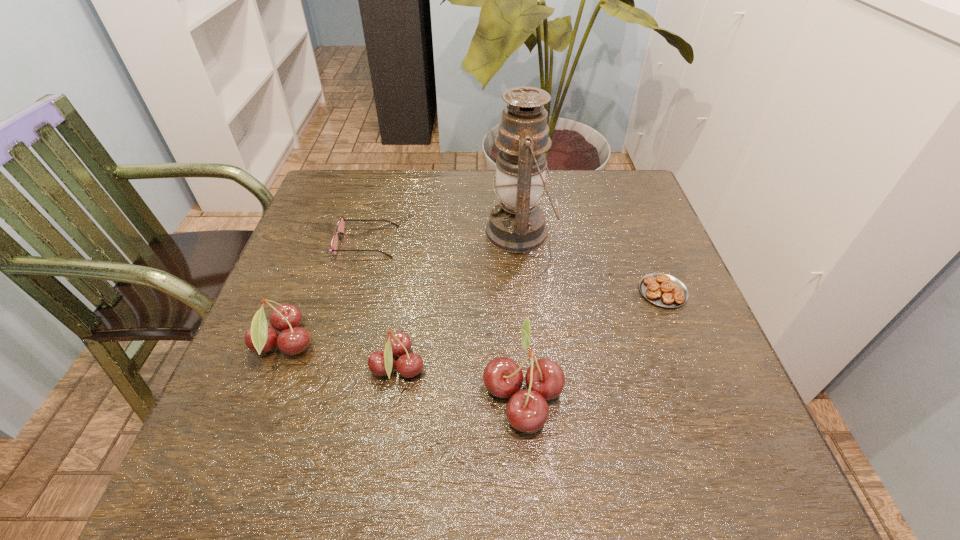
Select which object appears as the fourth closest to the fourth tallest object. Please provide its 2D coordinates. Your answer should be formatted as a tuple, i.e. [(x, y)], where the tuple contains the x and y coordinates of a point satisfying the conditions above.

[(517, 225)]

Select which cherry is the third closest to the second shortest object. Please provide its 2D coordinates. Your answer should be formatted as a tuple, i.e. [(x, y)], where the tuple contains the x and y coordinates of a point satisfying the conditions above.

[(527, 411)]

Find the location of `the closest cherry to the fifth tallest object`. the closest cherry to the fifth tallest object is located at coordinates (286, 318).

You are a GUI agent. You are given a task and a screenshot of the screen. Output one action in this format:
    pyautogui.click(x=<x>, y=<y>)
    Task: Click on the free space in the image that satisfies the following two spatial constraints: 1. on the front side of the tallest object; 2. on the leaves of the third tallest object
    The height and width of the screenshot is (540, 960).
    Given the screenshot: What is the action you would take?
    pyautogui.click(x=531, y=345)

At what (x,y) coordinates should I click in order to perform the action: click on vacant area that satisfies the following two spatial constraints: 1. on the bridge of the sunglasses; 2. on the back side of the shortest object. Please return your answer as a coordinate pair (x, y). Image resolution: width=960 pixels, height=540 pixels. Looking at the image, I should click on click(x=352, y=292).

Where is `free space that satisfies the following two spatial constraints: 1. on the front side of the oil lamp; 2. on the leaves of the third shortest object`? The image size is (960, 540). free space that satisfies the following two spatial constraints: 1. on the front side of the oil lamp; 2. on the leaves of the third shortest object is located at coordinates (534, 368).